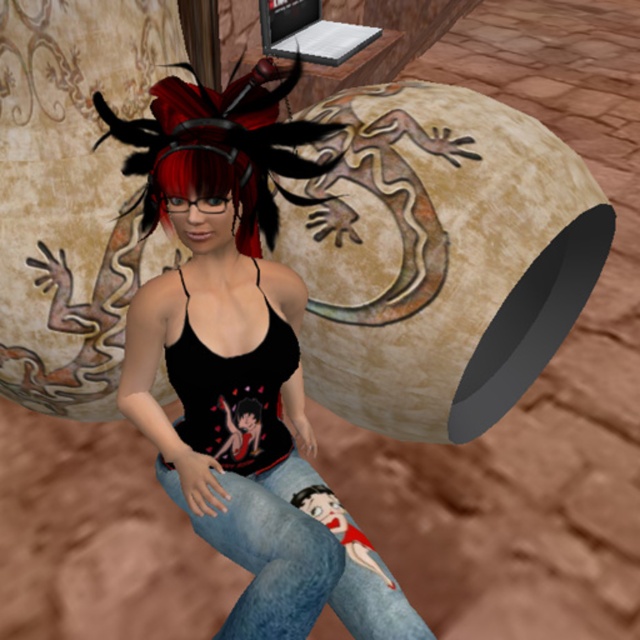
Question: Which of the following is the closest to the observer?

Choices:
 (A) denim jeans at center
 (B) matte black tank top at center

Answer: (A)

Question: In this image, where is matte black tank top at center located relative to denim jeans at center?

Choices:
 (A) left
 (B) right

Answer: (A)

Question: From the image, what is the correct spatial relationship of matte black tank top at center in relation to denim jeans at center?

Choices:
 (A) right
 (B) left

Answer: (B)

Question: Which point appears closest to the camera in this image?

Choices:
 (A) (147, 328)
 (B) (356, 579)

Answer: (A)

Question: Is matte black tank top at center further to the viewer compared to denim jeans at center?

Choices:
 (A) no
 (B) yes

Answer: (B)